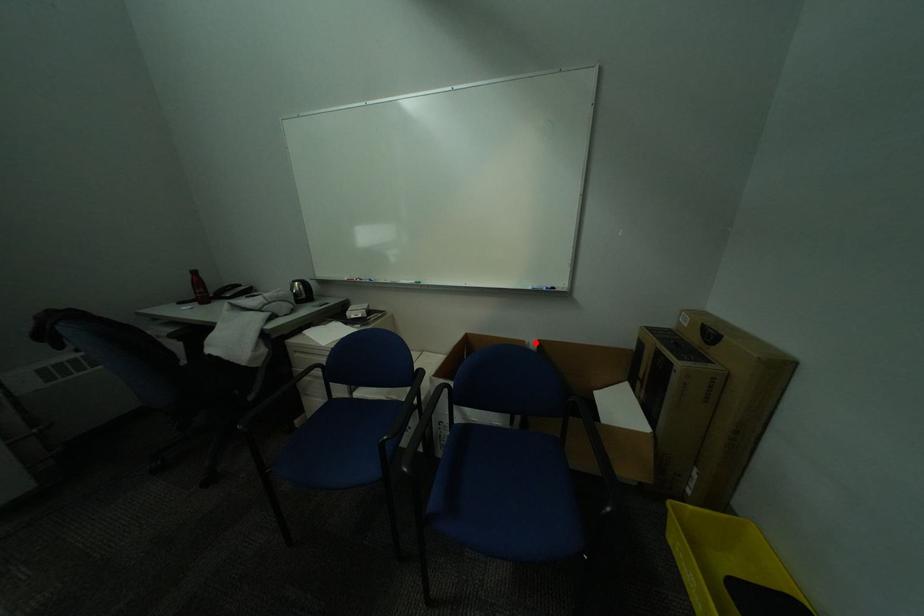
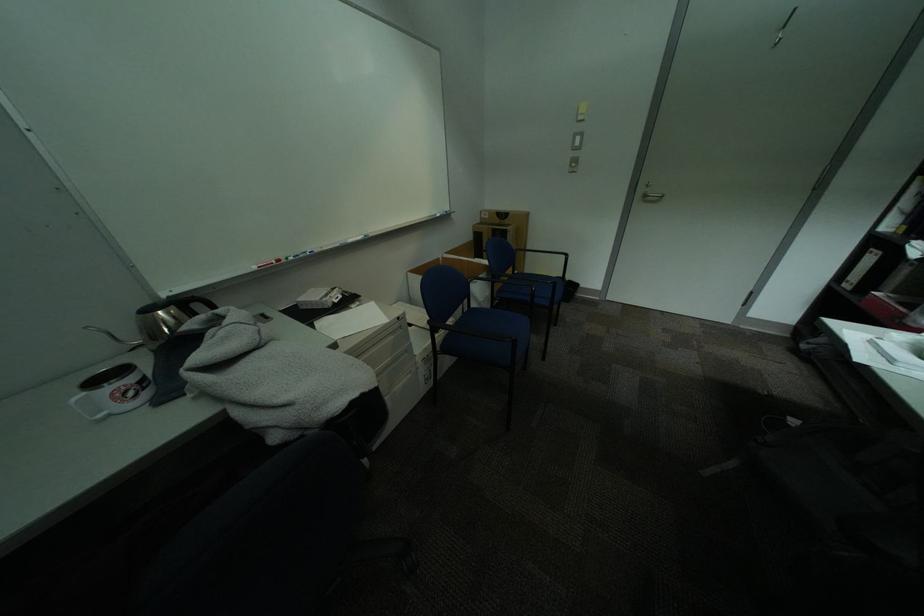
Find the pixel in the second image that matches the highlighted location in the first image.

(450, 259)